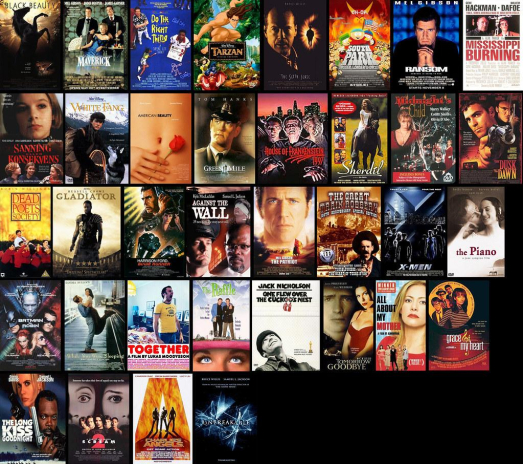
The width and height of the screenshot is (523, 464). I want to click on bottom row of movies, so click(238, 431), click(154, 410), click(103, 417), click(31, 408).